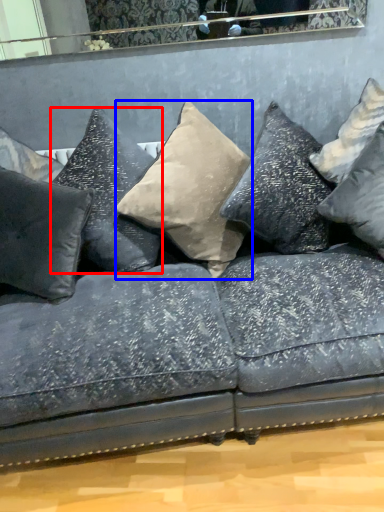
Question: Which object appears farthest to the camera in this image, pillow (highlighted by a red box) or pillow (highlighted by a blue box)?

Choices:
 (A) pillow
 (B) pillow

Answer: (A)